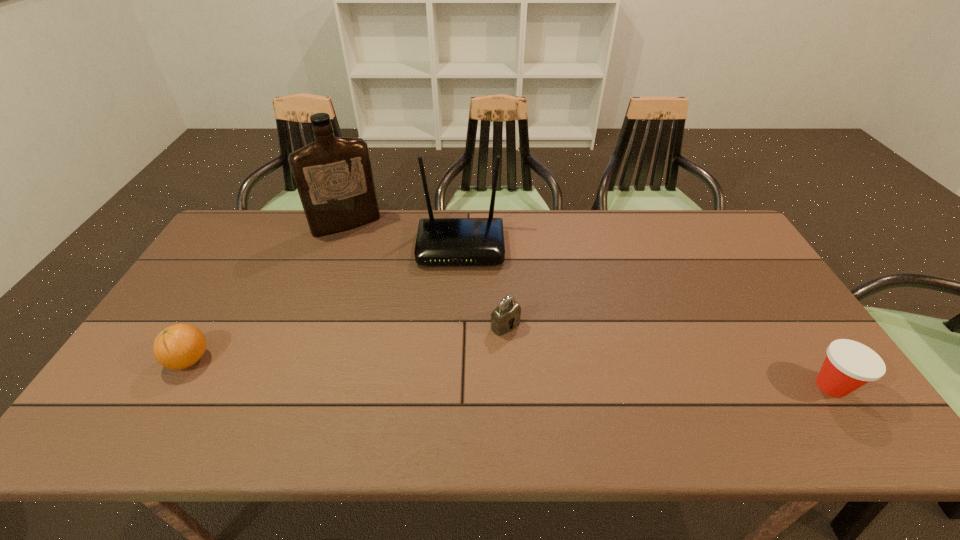
This screenshot has width=960, height=540. Identify the location of free space between the orange and the Dixie cup. (511, 373).

I want to click on unoccupied area between the leftmost object and the second tallest object, so click(325, 303).

Locate an element on the screen. This screenshot has width=960, height=540. free space between the liquor and the orange is located at coordinates point(268,292).

Image resolution: width=960 pixels, height=540 pixels. Find the location of `vacant area that lies between the third nearest object and the liquor`. vacant area that lies between the third nearest object and the liquor is located at coordinates (426, 275).

The width and height of the screenshot is (960, 540). Identify the location of unoccupied position between the leftmost object and the rightmost object. (511, 373).

Identify the location of free space between the tallest object and the router. This screenshot has height=540, width=960. (403, 235).

Find the location of a particular element. The height and width of the screenshot is (540, 960). free point between the orange and the second tallest object is located at coordinates (325, 303).

The width and height of the screenshot is (960, 540). Identify the location of vacant point located between the second object from left to right and the orange. (268, 292).

I want to click on vacant region between the tallest object and the router, so click(x=403, y=235).

Select which object is the fourth closest to the third farthest object. Please provide its 2D coordinates. Your answer should be formatted as a tuple, i.e. [(x, y)], where the tuple contains the x and y coordinates of a point satisfying the conditions above.

[(179, 346)]